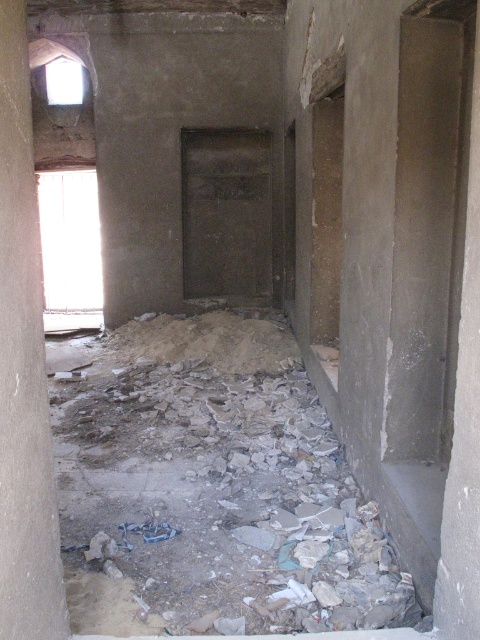
Does gray concrete pillar at left have a smaller size compared to transparent glass window at upper left?

Yes, gray concrete pillar at left is smaller than transparent glass window at upper left.

Measure the distance between gray concrete pillar at left and transparent glass window at upper left.

gray concrete pillar at left is 22.63 feet away from transparent glass window at upper left.

Where is `gray concrete pillar at left`? The width and height of the screenshot is (480, 640). gray concrete pillar at left is located at coordinates (24, 369).

Can you confirm if crumbly concrete debris at lower center is positioned below gray concrete pillar at left?

Correct, crumbly concrete debris at lower center is located below gray concrete pillar at left.

Does crumbly concrete debris at lower center have a greater width compared to gray concrete pillar at left?

Yes.

Which is in front, point (192, 532) or point (2, 166)?

Point (2, 166) is more forward.

At what (x,y) coordinates should I click in order to perform the action: click on crumbly concrete debris at lower center. Please return your answer as a coordinate pair (x, y). This screenshot has width=480, height=640. Looking at the image, I should click on (212, 490).

Can you confirm if crumbly concrete debris at lower center is wider than transparent glass window at upper left?

Yes.

Does point (88, 424) lie behind point (75, 317)?

That is False.

Is point (264, 404) behind point (80, 314)?

No, it is in front of (80, 314).

Identify the location of crumbly concrete debris at lower center. This screenshot has width=480, height=640. pos(212,490).